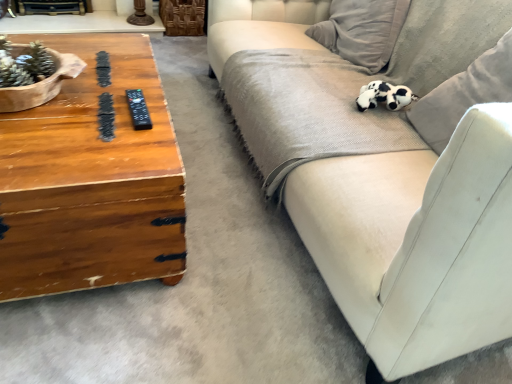
Where is `vacant space to the right of woodenmaterial/texturecoffee table at left`? This screenshot has height=384, width=512. vacant space to the right of woodenmaterial/texturecoffee table at left is located at coordinates (236, 252).